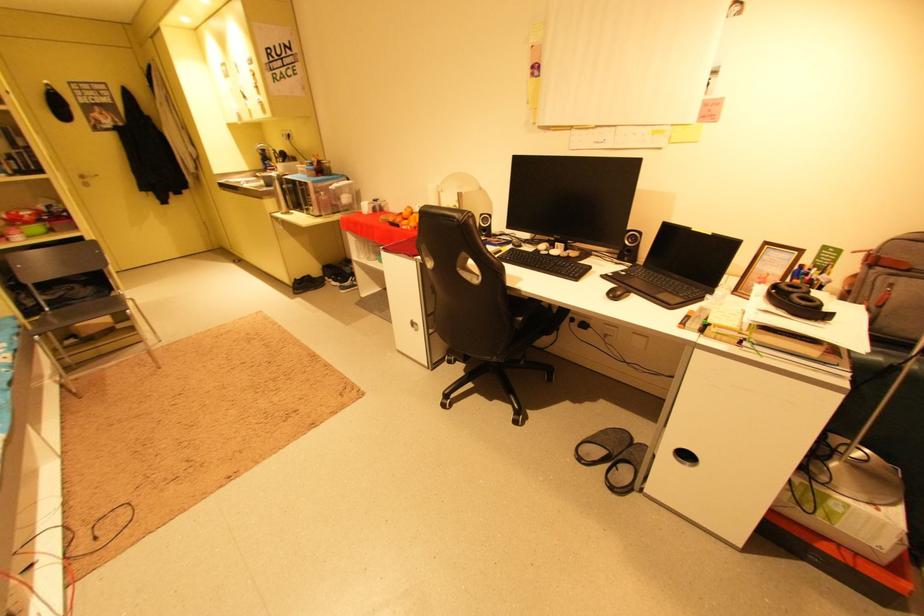
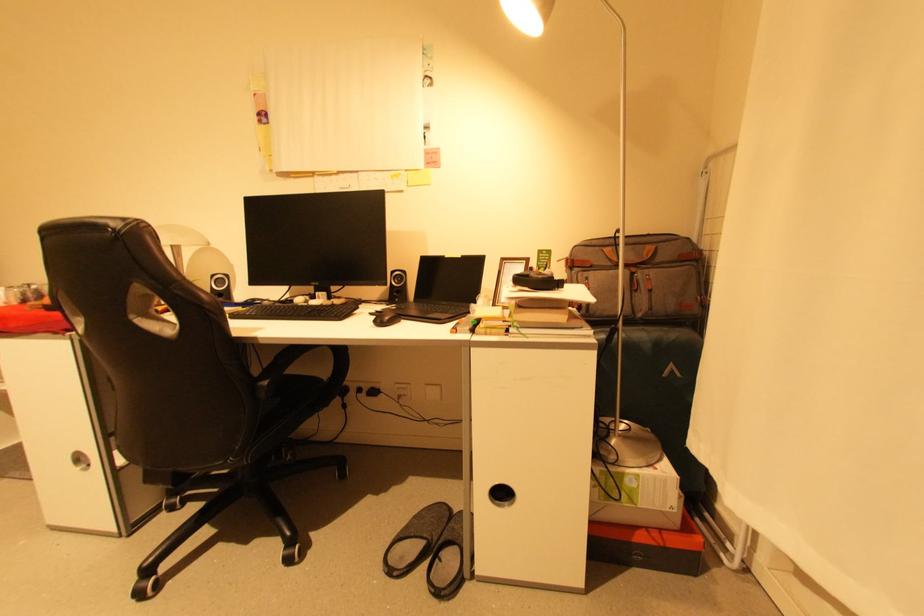
Question: The images are taken continuously from a first-person perspective. In which direction is your viewpoint rotating?

Choices:
 (A) Left
 (B) Right
 (C) Up
 (D) Down

Answer: (B)